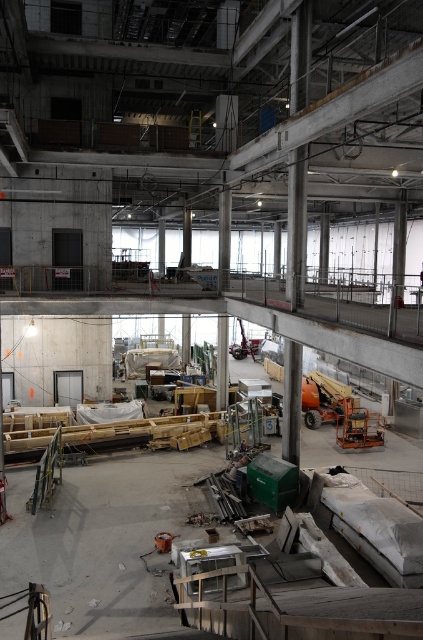
Between matte gray concrete pillar at center and metallic orange forklift at center, which one has less height?

metallic orange forklift at center

Can you confirm if matte gray concrete pillar at center is positioned below metallic orange forklift at center?

Indeed, matte gray concrete pillar at center is positioned under metallic orange forklift at center.

What do you see at coordinates (222, 362) in the screenshot? I see `matte gray concrete pillar at center` at bounding box center [222, 362].

Where is `matte gray concrete pillar at center`? The width and height of the screenshot is (423, 640). matte gray concrete pillar at center is located at coordinates (222, 362).

Can you confirm if concrete floor at center is taller than matte gray concrete pillar at center?

Yes.

From the picture: Who is taller, concrete floor at center or matte gray concrete pillar at center?

concrete floor at center is taller.

Who is more forward, (107, 513) or (225, 371)?

Point (107, 513) is in front.

You are a GUI agent. You are given a task and a screenshot of the screen. Output one action in this format:
    pyautogui.click(x=<x>, y=<y>)
    Task: Click on the concrete floor at center
    
    Given the screenshot: What is the action you would take?
    pyautogui.click(x=106, y=538)

Does concrete floor at center appear over metallic orange forklift at center?

No.

Between point (175, 480) and point (235, 355), which one is positioned in front?

Point (175, 480) is in front.

Where is `concrete floor at center`? concrete floor at center is located at coordinates (106, 538).

The image size is (423, 640). What are the coordinates of `concrete floor at center` in the screenshot? It's located at (106, 538).